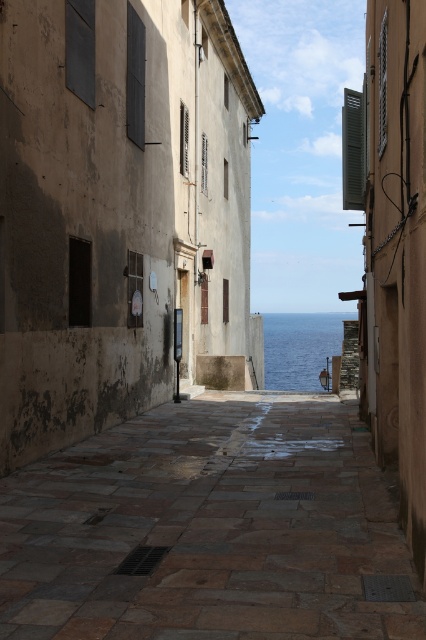
Consider the image. You are standing at the entrance of the alleyway and want to know if the blue water at center is wider than the matte wood shutter at upper right. Can you tell me which one is wider?

The blue water at center is wider than the matte wood shutter at upper right.